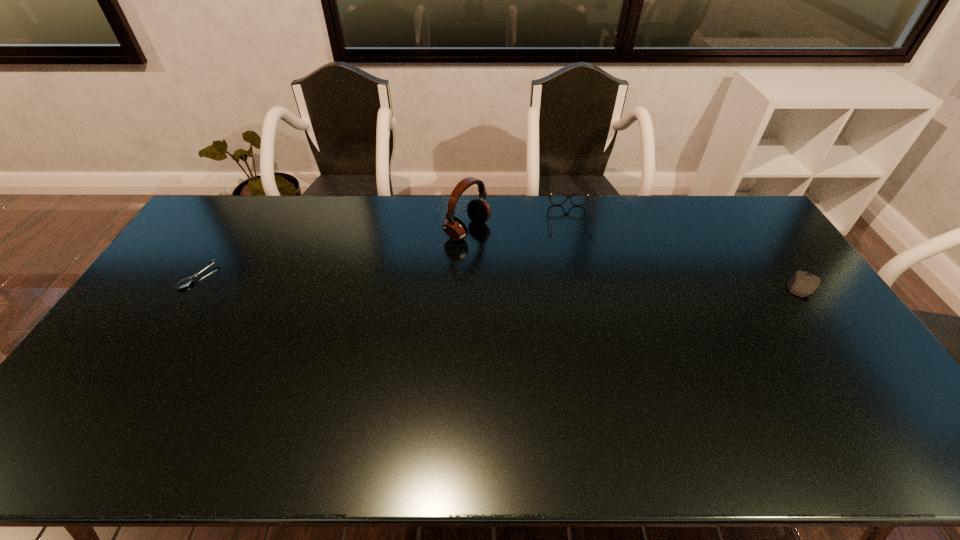
Locate an element on the screen. free space on the desktop that is between the leftmost object and the second shortest object and is positioned on the ear pads of the headset is located at coordinates (570, 282).

You are a GUI agent. You are given a task and a screenshot of the screen. Output one action in this format:
    pyautogui.click(x=<x>, y=<y>)
    Task: Click on the vacant spot on the desktop that is between the shortest object and the computer equipment and is positioned with the lenses facing outward on the third object from left to right
    
    Given the screenshot: What is the action you would take?
    pyautogui.click(x=579, y=283)